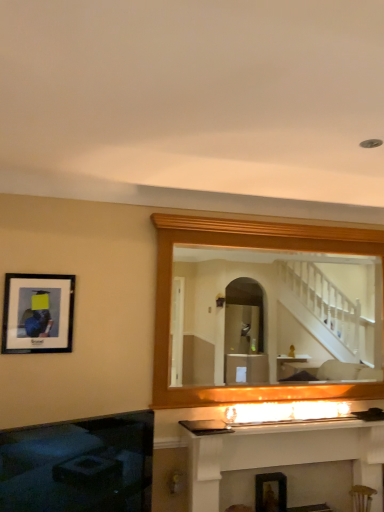
Question: Is white glossy fireplace at center, which is the second fireplace from left to right, outside black glass fireplace at lower left, which ranks as the first fireplace in left-to-right order?

Choices:
 (A) no
 (B) yes

Answer: (B)

Question: From a real-world perspective, is white glossy fireplace at center, which is the second fireplace from left to right, located beneath black glass fireplace at lower left, the 2th fireplace viewed from the right?

Choices:
 (A) yes
 (B) no

Answer: (A)

Question: Considering the relative sizes of white glossy fireplace at center, positioned as the first fireplace in right-to-left order, and black glass fireplace at lower left, which ranks as the first fireplace in left-to-right order, in the image provided, is white glossy fireplace at center, positioned as the first fireplace in right-to-left order, taller than black glass fireplace at lower left, which ranks as the first fireplace in left-to-right order,?

Choices:
 (A) yes
 (B) no

Answer: (A)

Question: Are white glossy fireplace at center, which is the second fireplace from left to right, and black glass fireplace at lower left, the 2th fireplace viewed from the right, located far from each other?

Choices:
 (A) yes
 (B) no

Answer: (B)

Question: Is black glass fireplace at lower left, the 2th fireplace viewed from the right, inside white glossy fireplace at center, which is the second fireplace from left to right?

Choices:
 (A) no
 (B) yes

Answer: (A)

Question: Is white glossy fireplace at center, which is the second fireplace from left to right, at the right side of black glass fireplace at lower left, which ranks as the first fireplace in left-to-right order?

Choices:
 (A) yes
 (B) no

Answer: (A)

Question: Is wooden mirror at upper center not near black glass fireplace at lower left, the 2th fireplace viewed from the right?

Choices:
 (A) yes
 (B) no

Answer: (A)

Question: Is wooden mirror at upper center closer to camera compared to black glass fireplace at lower left, which ranks as the first fireplace in left-to-right order?

Choices:
 (A) yes
 (B) no

Answer: (B)

Question: Is black glass fireplace at lower left, the 2th fireplace viewed from the right, at the back of wooden mirror at upper center?

Choices:
 (A) no
 (B) yes

Answer: (A)

Question: From a real-world perspective, is wooden mirror at upper center under black glass fireplace at lower left, which ranks as the first fireplace in left-to-right order?

Choices:
 (A) yes
 (B) no

Answer: (B)

Question: Can you confirm if wooden mirror at upper center is taller than black glass fireplace at lower left, which ranks as the first fireplace in left-to-right order?

Choices:
 (A) no
 (B) yes

Answer: (B)

Question: Is wooden mirror at upper center facing towards black glass fireplace at lower left, which ranks as the first fireplace in left-to-right order?

Choices:
 (A) yes
 (B) no

Answer: (B)

Question: Is the depth of matte black picture frame at left greater than that of wooden mirror at upper center?

Choices:
 (A) no
 (B) yes

Answer: (A)